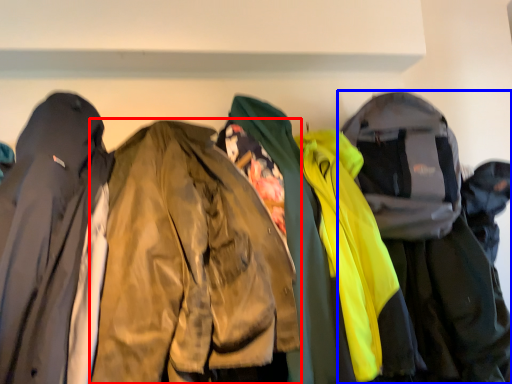
Question: Which object is closer to the camera taking this photo, jacket (highlighted by a red box) or jacket (highlighted by a blue box)?

Choices:
 (A) jacket
 (B) jacket

Answer: (A)